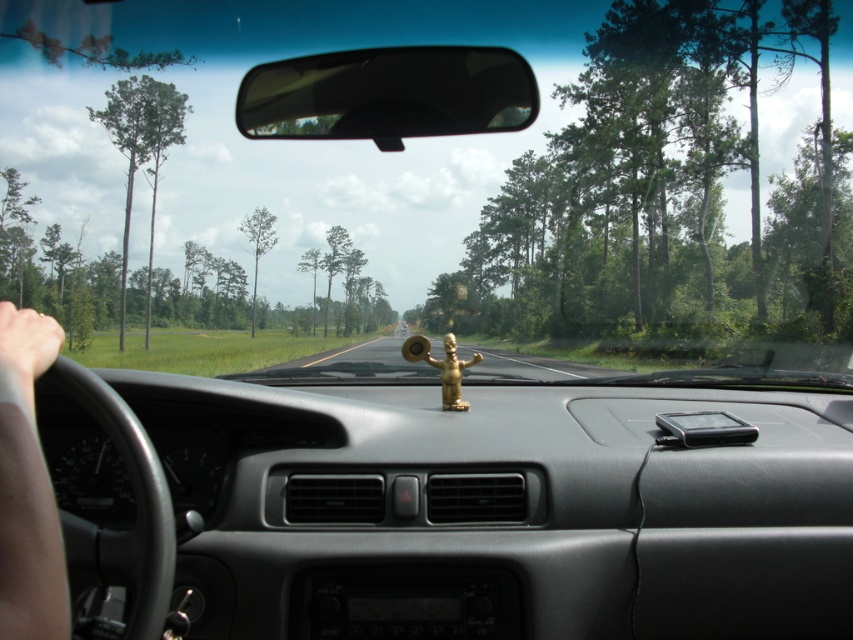
You are driving a car and looking at the dashboard. There are two points marked on the windshield at coordinates point [4,390] and point [35,328]. From your perspective inside the car, which point is closer to the front of the car?

Point [4,390] is in front of point [35,328], so it is closer to the front of the car.

You are a passenger in the car and want to reach the smartphone on the right side of the central console. There is a skinny tan arm at lower left in your way. Where is the skinny tan arm located relative to the smartphone?

The skinny tan arm at lower left is located at point [27,484], which is near the lower left area of the scene, so it is not directly blocking the smartphone on the right side of the central console.